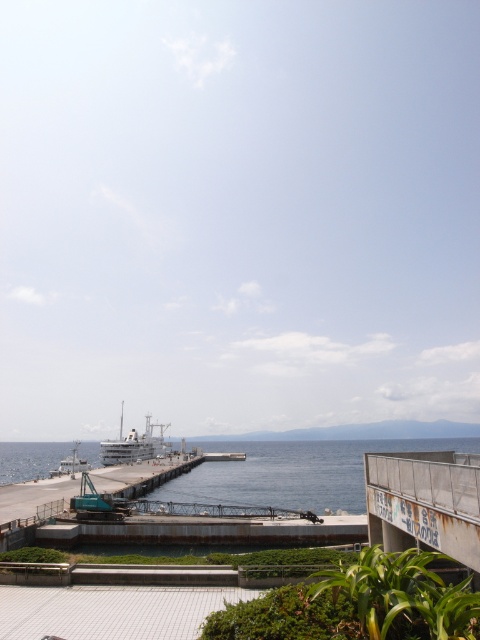
You are standing on the paved walkway and want to board the white glossy ship at center. Which direction should you move to reach it from the rusty metal dock at lower right?

Since the rusty metal dock at lower right is located above the white glossy ship at center, you should move downward from the rusty metal dock at lower right to reach the white glossy ship at center.

In the scene shown: You are a tourist standing on the paved walkway and want to take a photo of both the white matte ship at lower left and the white glossy ship at center. Which ship should you position closer to the front of your camera frame to include both in the photo?

Since the white matte ship at lower left is shorter than the white glossy ship at center, you should position the white matte ship at lower left closer to the front of your camera frame to ensure both ships are fully visible in the photo.